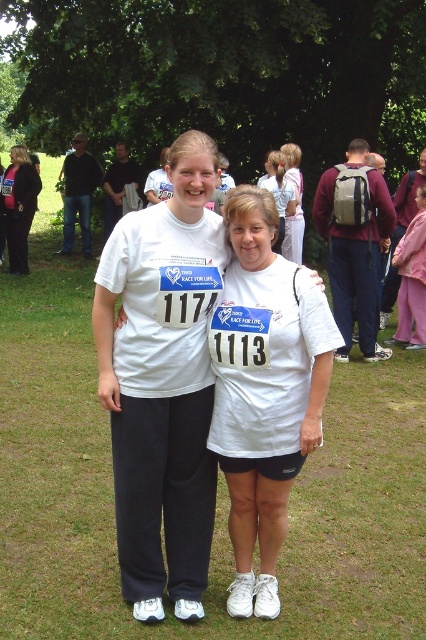
Question: Does pink fabric coat at right appear on the right side of black fabric pants at left?

Choices:
 (A) no
 (B) yes

Answer: (B)

Question: Which point is closer to the camera taking this photo?

Choices:
 (A) (425, 308)
 (B) (9, 189)

Answer: (A)

Question: Observing the image, what is the correct spatial positioning of pink fabric coat at right in reference to black fabric pants at left?

Choices:
 (A) left
 (B) right

Answer: (B)

Question: Where is pink fabric coat at right located in relation to black fabric pants at left in the image?

Choices:
 (A) left
 (B) right

Answer: (B)

Question: Which object is farther from the camera taking this photo?

Choices:
 (A) pink fabric coat at right
 (B) black fabric pants at left

Answer: (B)